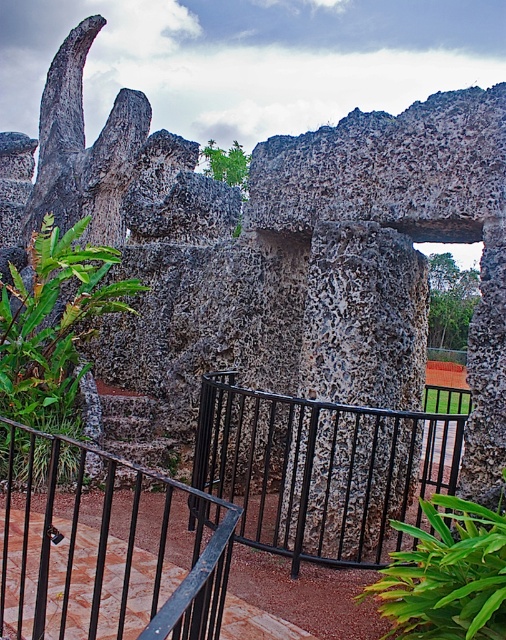
Question: Which point appears farthest from the camera in this image?

Choices:
 (A) (500, 634)
 (B) (97, 276)
 (C) (455, 420)
 (D) (136, 548)

Answer: (B)

Question: Considering the relative positions of green leafy plant at left and rough stone stairs at center in the image provided, where is green leafy plant at left located with respect to rough stone stairs at center?

Choices:
 (A) below
 (B) above

Answer: (B)

Question: Considering the real-world distances, which object is farthest from the green leafy plant at left?

Choices:
 (A) black metal/rail at center
 (B) green leafy plant at lower right
 (C) black metal balustrade at center
 (D) rough stone stairs at center

Answer: (B)

Question: Among these objects, which one is farthest from the camera?

Choices:
 (A) rough stone stairs at center
 (B) green leafy plant at lower right

Answer: (A)

Question: Can you confirm if black metal balustrade at center is positioned below green leafy plant at lower right?

Choices:
 (A) yes
 (B) no

Answer: (A)

Question: Is green leafy plant at left smaller than green leafy plant at lower right?

Choices:
 (A) yes
 (B) no

Answer: (B)